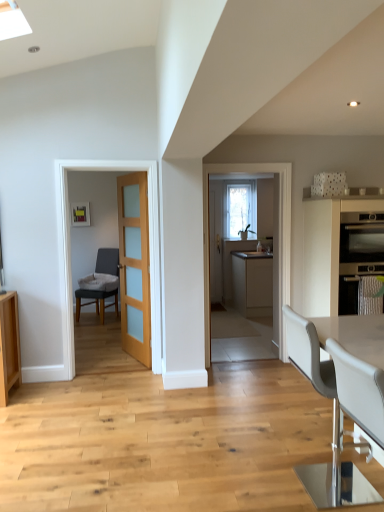
Question: Is matte stainless steel oven at right oriented towards light brown wood door at center?

Choices:
 (A) yes
 (B) no

Answer: (B)

Question: Can you confirm if matte stainless steel oven at right is bigger than light brown wood door at center?

Choices:
 (A) yes
 (B) no

Answer: (B)

Question: Does matte stainless steel oven at right have a smaller size compared to light brown wood door at center?

Choices:
 (A) no
 (B) yes

Answer: (B)

Question: Is matte stainless steel oven at right thinner than light brown wood door at center?

Choices:
 (A) no
 (B) yes

Answer: (A)

Question: Considering the relative sizes of matte stainless steel oven at right and light brown wood door at center in the image provided, is matte stainless steel oven at right wider than light brown wood door at center?

Choices:
 (A) yes
 (B) no

Answer: (A)

Question: From the image's perspective, is matte stainless steel oven at right on light brown wood door at center?

Choices:
 (A) yes
 (B) no

Answer: (A)

Question: Can you confirm if white leather chair at lower right, placed as the second chair when sorted from front to back, is taller than matte stainless steel oven at right?

Choices:
 (A) yes
 (B) no

Answer: (A)

Question: From the image's perspective, is white leather chair at lower right, the 1th chair viewed from the right, on top of matte stainless steel oven at right?

Choices:
 (A) no
 (B) yes

Answer: (A)

Question: Is the position of white leather chair at lower right, the 1th chair viewed from the right, more distant than that of matte stainless steel oven at right?

Choices:
 (A) yes
 (B) no

Answer: (B)

Question: Does white leather chair at lower right, which appears as the third chair when viewed from the left, have a smaller size compared to matte stainless steel oven at right?

Choices:
 (A) no
 (B) yes

Answer: (A)

Question: Is white leather chair at lower right, which appears as the third chair when viewed from the left, turned away from matte stainless steel oven at right?

Choices:
 (A) no
 (B) yes

Answer: (A)

Question: Can you confirm if white leather chair at lower right, which appears as the third chair when viewed from the left, is thinner than matte stainless steel oven at right?

Choices:
 (A) no
 (B) yes

Answer: (B)

Question: Does matte beige cabinet at center, the first cabinetry when ordered from back to front, have a greater height compared to white leather chair at lower right, acting as the second chair starting from the left?

Choices:
 (A) yes
 (B) no

Answer: (A)